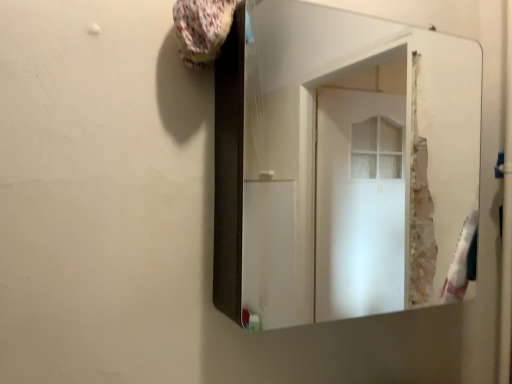
What is the approximate width of white glossy cabinet at upper center?

white glossy cabinet at upper center is 2.54 inches in width.

This screenshot has width=512, height=384. Describe the element at coordinates (339, 163) in the screenshot. I see `white glossy cabinet at upper center` at that location.

Locate an element on the screen. The image size is (512, 384). white glossy cabinet at upper center is located at coordinates (339, 163).

Identify the location of white glossy cabinet at upper center. This screenshot has width=512, height=384. (339, 163).